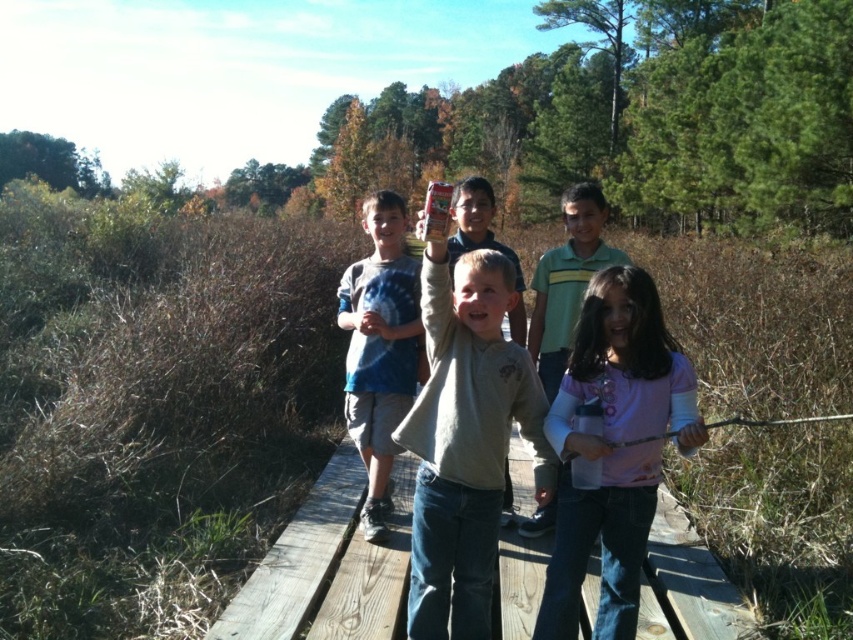
Is point (659, 548) positioned before point (431, 496)?

No, (659, 548) is further to viewer.

Which is more to the left, wooden plank at center or light gray cotton shirt at center?

Positioned to the left is wooden plank at center.

You are a GUI agent. You are given a task and a screenshot of the screen. Output one action in this format:
    pyautogui.click(x=<x>, y=<y>)
    Task: Click on the wooden plank at center
    Image resolution: width=853 pixels, height=640 pixels.
    Given the screenshot: What is the action you would take?
    pyautogui.click(x=328, y=566)

Find the location of a particular element. The width and height of the screenshot is (853, 640). wooden plank at center is located at coordinates (328, 566).

Is wooden plank at center to the left of pink fleece shirt at center from the viewer's perspective?

Yes, wooden plank at center is to the left of pink fleece shirt at center.

Between point (717, 627) and point (554, 401), which one is positioned in front?

Point (554, 401) is more forward.

Find the location of a particular element. This screenshot has width=853, height=640. wooden plank at center is located at coordinates (328, 566).

Does point (368, 564) come farther from viewer compared to point (386, 456)?

No.

Looking at this image, does wooden plank at center come in front of tie-dye t-shirt at center?

Yes, it is.

Between point (332, 461) and point (410, 353), which one is positioned behind?

Positioned behind is point (332, 461).

The width and height of the screenshot is (853, 640). Identify the location of wooden plank at center. (328, 566).